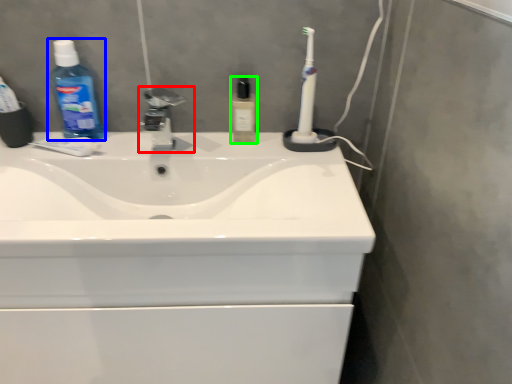
Question: Estimate the real-world distances between objects in this image. Which object is closer to tap (highlighted by a red box), cleaning product (highlighted by a blue box) or toiletry (highlighted by a green box)?

Choices:
 (A) cleaning product
 (B) toiletry

Answer: (A)